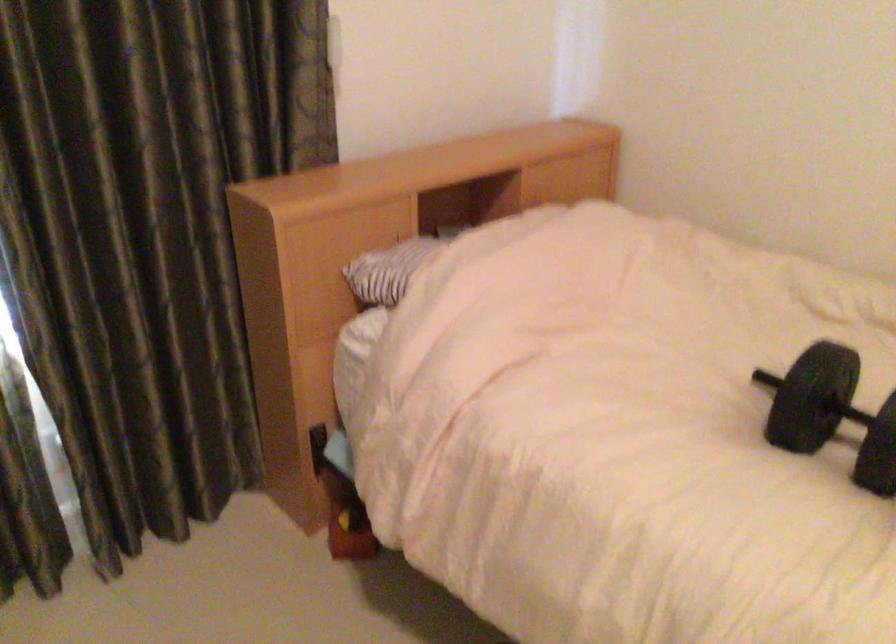
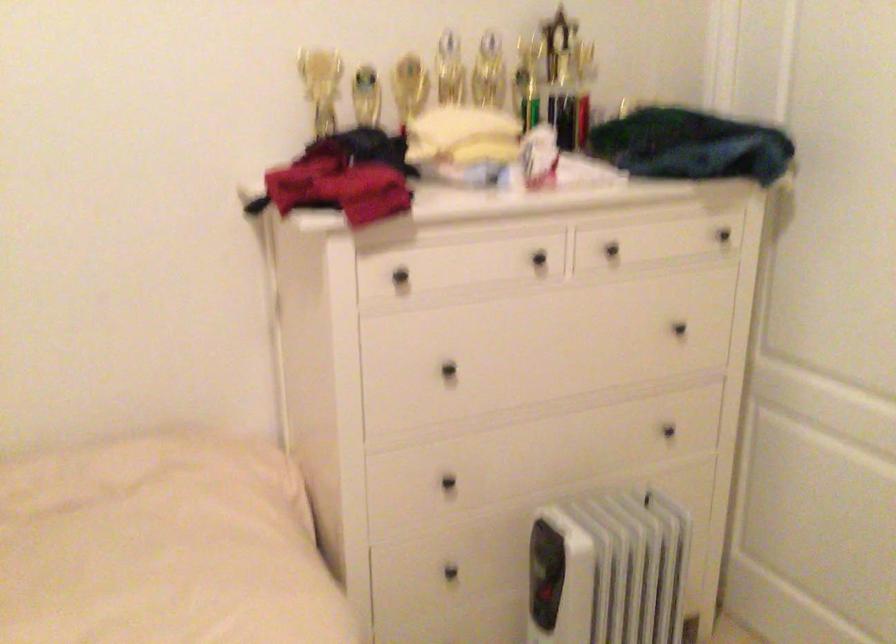
Question: How did the camera likely rotate?

Choices:
 (A) Left
 (B) Right
 (C) Up
 (D) Down

Answer: (B)